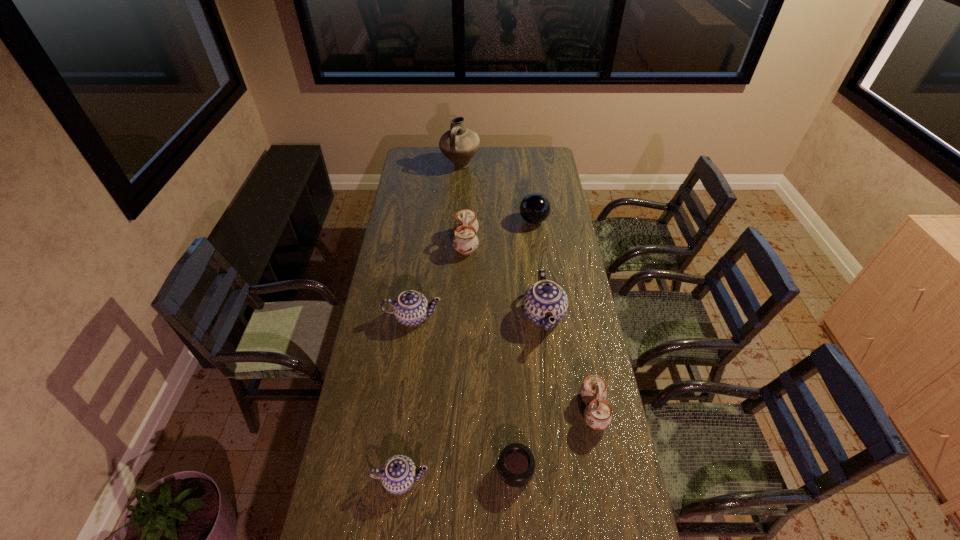
You are a GUI agent. You are given a task and a screenshot of the screen. Output one action in this format:
    pyautogui.click(x=<x>, y=<y>)
    Task: Click on the empty space between the bowling ball and the seventh tallest object
    
    Given the screenshot: What is the action you would take?
    pyautogui.click(x=468, y=350)

Identify the location of free space between the bowling ball and the tallest object. Image resolution: width=960 pixels, height=540 pixels. (497, 193).

Locate which object is the seventh closest to the farthest chinaware. Please provide its 2D coordinates. Your answer should be formatted as a tuple, i.e. [(x, y)], where the tuple contains the x and y coordinates of a point satisfying the conditions above.

[(398, 474)]

Identify which object is the fifth closest to the farthest object. Please provide its 2D coordinates. Your answer should be formatted as a tuple, i.e. [(x, y)], where the tuple contains the x and y coordinates of a point satisfying the conditions above.

[(598, 415)]

Identify which chinaware is the second nearest to the telephoto lens. Please provide its 2D coordinates. Your answer should be formatted as a tuple, i.e. [(x, y)], where the tuple contains the x and y coordinates of a point satisfying the conditions above.

[(398, 474)]

The image size is (960, 540). I want to click on chinaware that is the second closest to the rightmost blue chinaware, so 465,241.

Point out which blue chinaware is positioned as the nearest to the rightmost blue chinaware. Please provide its 2D coordinates. Your answer should be formatted as a tuple, i.e. [(x, y)], where the tuple contains the x and y coordinates of a point satisfying the conditions above.

[(410, 308)]

You are a GUI agent. You are given a task and a screenshot of the screen. Output one action in this format:
    pyautogui.click(x=<x>, y=<y>)
    Task: Click on the blue chinaware that is the closest to the second biggest blue chinaware
    
    Given the screenshot: What is the action you would take?
    pyautogui.click(x=545, y=299)

This screenshot has height=540, width=960. Find the location of `vacant space that satisfies the following two spatial constraints: 1. at the spout of the biggest blue chinaware; 2. at the spout of the smallest blue chinaware`. vacant space that satisfies the following two spatial constraints: 1. at the spout of the biggest blue chinaware; 2. at the spout of the smallest blue chinaware is located at coordinates (564, 480).

Locate an element on the screen. The width and height of the screenshot is (960, 540). free space that satisfies the following two spatial constraints: 1. by the handle of the farthest chinaware; 2. at the spout of the smallest blue chinaware is located at coordinates (458, 480).